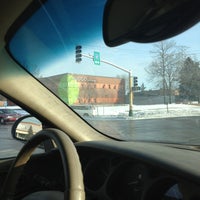
Find the location of a particular element. Image resolution: width=200 pixels, height=200 pixels. window is located at coordinates (4, 135).